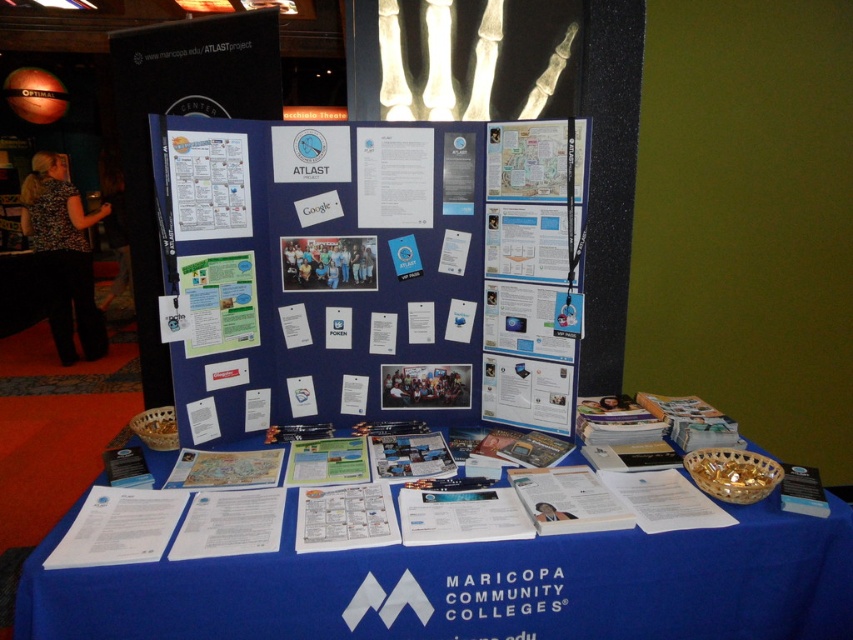
Question: Estimate the real-world distances between objects in this image. Which object is closer to the blue paperboard poster at center?

Choices:
 (A) white paper at upper left
 (B) blue fabric table at lower center
 (C) blue matte poster at center

Answer: (C)

Question: Can you confirm if blue paperboard poster at center is bigger than blue matte poster at center?

Choices:
 (A) no
 (B) yes

Answer: (B)

Question: Based on their relative distances, which object is nearer to the white paper at center?

Choices:
 (A) white paper at upper left
 (B) green paper at center
 (C) blue paperboard poster at center

Answer: (C)

Question: Does blue paperboard poster at center have a larger size compared to green paper at center?

Choices:
 (A) yes
 (B) no

Answer: (A)

Question: Can you confirm if white paper at center is positioned to the left of green paper at center?

Choices:
 (A) no
 (B) yes

Answer: (A)

Question: Among these objects, which one is nearest to the camera?

Choices:
 (A) green paper at center
 (B) white paper at center

Answer: (A)